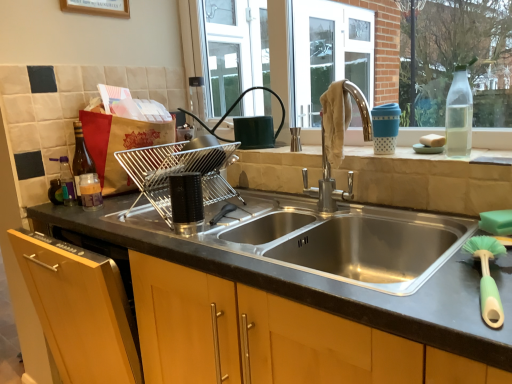
In the scene shown: In order to face stainless steel sink at center, should I rotate leftwards or rightwards?

It's best to rotate right around 0.692 degrees.

In order to face chrome metallic faucet at upper center, should I rotate leftwards or rightwards?

Turn right approximately 11.323 degrees to face it.

Based on the photo, what is the approximate height of transparent glass bottle at upper right, positioned as the fourth bottle in left-to-right order?

The height of transparent glass bottle at upper right, positioned as the fourth bottle in left-to-right order, is 9.16 inches.

The width and height of the screenshot is (512, 384). Describe the element at coordinates (55, 192) in the screenshot. I see `translucent plastic bottle at left, placed as the fourth bottle when sorted from front to back` at that location.

You are a GUI agent. You are given a task and a screenshot of the screen. Output one action in this format:
    pyautogui.click(x=<x>, y=<y>)
    Task: Click on the matte glass bottle at left, placed as the second bottle when sorted from back to front
    This screenshot has height=384, width=512.
    Given the screenshot: What is the action you would take?
    pyautogui.click(x=81, y=158)

The height and width of the screenshot is (384, 512). I want to click on metallic silver dish rack at sink, the 1th appliance from the back, so click(x=178, y=173).

Is point (56, 195) behind point (448, 96)?

Yes, it is behind point (448, 96).

How different are the orientations of translucent plastic bottle at left, placed as the fourth bottle when sorted from front to back, and transparent glass bottle at upper right, which is the 1th bottle from front to back, in degrees?

The facing directions of translucent plastic bottle at left, placed as the fourth bottle when sorted from front to back, and transparent glass bottle at upper right, which is the 1th bottle from front to back, are 0.00215 degrees apart.

Is translucent plastic bottle at left, the first bottle positioned from the back, not near transparent glass bottle at upper right, the first bottle positioned from the right?

Yes, translucent plastic bottle at left, the first bottle positioned from the back, and transparent glass bottle at upper right, the first bottle positioned from the right, are located far from each other.

Is green plastic brush at lower right far from black granite countertop at center?

That's not correct — green plastic brush at lower right is a little close to black granite countertop at center.

Based on the photo, could you tell me if green plastic brush at lower right is turned towards black granite countertop at center?

No, green plastic brush at lower right does not turn towards black granite countertop at center.

From the image's perspective, between green plastic brush at lower right and black granite countertop at center, who is located below?

black granite countertop at center appears lower in the image.

Is green plastic brush at lower right inside the boundaries of black granite countertop at center, or outside?

green plastic brush at lower right is located beyond the bounds of black granite countertop at center.

From the picture: Does translucent plastic bottle at left, the second bottle positioned from the front, have a larger size compared to white sponge at right?

Yes.

Can you confirm if translucent plastic bottle at left, which is the third bottle from back to front, is positioned to the right of white sponge at right?

No.

Who is taller, translucent plastic bottle at left, which is counted as the third bottle, starting from the left, or white sponge at right?

With more height is translucent plastic bottle at left, which is counted as the third bottle, starting from the left.

From a real-world perspective, is translucent plastic bottle at left, the second bottle positioned from the front, physically located above or below white sponge at right?

Clearly, from a real-world perspective, translucent plastic bottle at left, the second bottle positioned from the front, is below white sponge at right.

This screenshot has height=384, width=512. Identify the location of food on the right of green plastic brush at lower right. (432, 140).

From the image's perspective, between white sponge at right and green plastic brush at lower right, which one is located above?

white sponge at right, from the image's perspective.

Which of these two, white sponge at right or green plastic brush at lower right, is bigger?

green plastic brush at lower right is bigger.

Would you say white sponge at right is to the left or to the right of green plastic brush at lower right in the picture?

white sponge at right is positioned on green plastic brush at lower right's right side.

Would you say metallic silver dish rack at sink, the 1th appliance from the back, is outside black granite countertop at center?

That's correct, metallic silver dish rack at sink, the 1th appliance from the back, is outside of black granite countertop at center.

Is metallic silver dish rack at sink, the 1th appliance from the back, aimed at black granite countertop at center?

No, metallic silver dish rack at sink, the 1th appliance from the back, is not oriented towards black granite countertop at center.

Considering the relative sizes of metallic silver dish rack at sink, the 2th appliance positioned from the front, and black granite countertop at center in the image provided, is metallic silver dish rack at sink, the 2th appliance positioned from the front, smaller than black granite countertop at center?

Indeed, metallic silver dish rack at sink, the 2th appliance positioned from the front, has a smaller size compared to black granite countertop at center.

Measure the distance between metallic silver dish rack at sink, the 1th appliance from the back, and black granite countertop at center.

metallic silver dish rack at sink, the 1th appliance from the back, is 11.65 inches from black granite countertop at center.

Which is farther, (490,290) or (374,256)?

The point (374,256) is more distant.

From a real-world perspective, which object rests below the other?

From a 3D spatial view, green plastic brush at lower right is below.

Is green plastic brush at lower right not near stainless steel sink at center?

No, green plastic brush at lower right is not far from stainless steel sink at center.

Can you confirm if translucent plastic bottle at left, the 1th bottle positioned from the left, is thinner than black granite countertop at center?

Yes, translucent plastic bottle at left, the 1th bottle positioned from the left, is thinner than black granite countertop at center.

Which is behind, point (62, 194) or point (174, 241)?

The point (62, 194) is farther.

Is translucent plastic bottle at left, the first bottle positioned from the back, turned away from black granite countertop at center?

No, translucent plastic bottle at left, the first bottle positioned from the back,'s orientation is not away from black granite countertop at center.

Is translucent plastic bottle at left, the first bottle positioned from the back, not near black granite countertop at center?

That's not correct — translucent plastic bottle at left, the first bottle positioned from the back, is a little close to black granite countertop at center.

Starting from the transparent glass bottle at upper right, which is the 1th bottle from front to back, which bottle is the 3rd one behind? Please provide its 2D coordinates.

[(55, 192)]

Find the location of a particular element. countertop directly beneath the green plastic brush at lower right (from a real-world perspective) is located at coordinates (324, 285).

Looking at the image, which one is located further to translucent plastic bottle at left, placed as the fourth bottle when sorted from front to back, transparent glass bottle at upper right, the first bottle positioned from the right, or green plastic brush at lower right?

green plastic brush at lower right.

Estimate the real-world distances between objects in this image. Which object is closer to stainless steel sink at center, black plastic dish rack at center, arranged as the first appliance when viewed from the front, or matte glass bottle at left, the 3th bottle in the right-to-left sequence?

black plastic dish rack at center, arranged as the first appliance when viewed from the front.

Looking at this image, which object lies nearer to the anchor point matte glass bottle at left, placed as the second bottle when sorted from back to front, white sponge at right or translucent plastic bottle at left, which ranks as the 4th bottle in right-to-left order?

translucent plastic bottle at left, which ranks as the 4th bottle in right-to-left order.

Looking at the image, which one is located closer to white sponge at right, stainless steel sink at center or translucent plastic bottle at left, the second bottle positioned from the front?

stainless steel sink at center is positioned closer to the anchor white sponge at right.

Which object lies nearer to the anchor point stainless steel sink at center, chrome metallic faucet at upper center or black plastic dish rack at center, arranged as the first appliance when viewed from the front?

chrome metallic faucet at upper center.

In the scene shown: Estimate the real-world distances between objects in this image. Which object is closer to white sponge at right, matte glass bottle at left, placed as the second bottle when sorted from back to front, or stainless steel sink at center?

Among the two, stainless steel sink at center is located nearer to white sponge at right.

Which object lies nearer to the anchor point transparent glass bottle at upper right, positioned as the fourth bottle in left-to-right order, white sponge at right or black granite countertop at center?

white sponge at right.

Which object lies nearer to the anchor point green plastic brush at lower right, black granite countertop at center or translucent plastic bottle at left, which ranks as the 4th bottle in right-to-left order?

Among the two, black granite countertop at center is located nearer to green plastic brush at lower right.

Find the location of `appliance situated between translucent plastic bottle at left, which is the third bottle from back to front, and black plastic dish rack at center, marked as the second appliance in a back-to-front arrangement, from left to right`. appliance situated between translucent plastic bottle at left, which is the third bottle from back to front, and black plastic dish rack at center, marked as the second appliance in a back-to-front arrangement, from left to right is located at coordinates (178, 173).

Identify the location of tap between translucent plastic bottle at left, the first bottle positioned from the back, and green plastic brush at lower right from left to right. (327, 183).

You are a GUI agent. You are given a task and a screenshot of the screen. Output one action in this format:
    pyautogui.click(x=<x>, y=<y>)
    Task: Click on the bottle situated between translucent plastic bottle at left, which ranks as the 4th bottle in right-to-left order, and translucent plastic bottle at left, which is the third bottle from back to front, from left to right
    
    Given the screenshot: What is the action you would take?
    pyautogui.click(x=81, y=158)

Identify the location of appliance between stainless steel sink at center and metallic silver dish rack at sink, the 2th appliance positioned from the front, in the front-back direction. (186, 203).